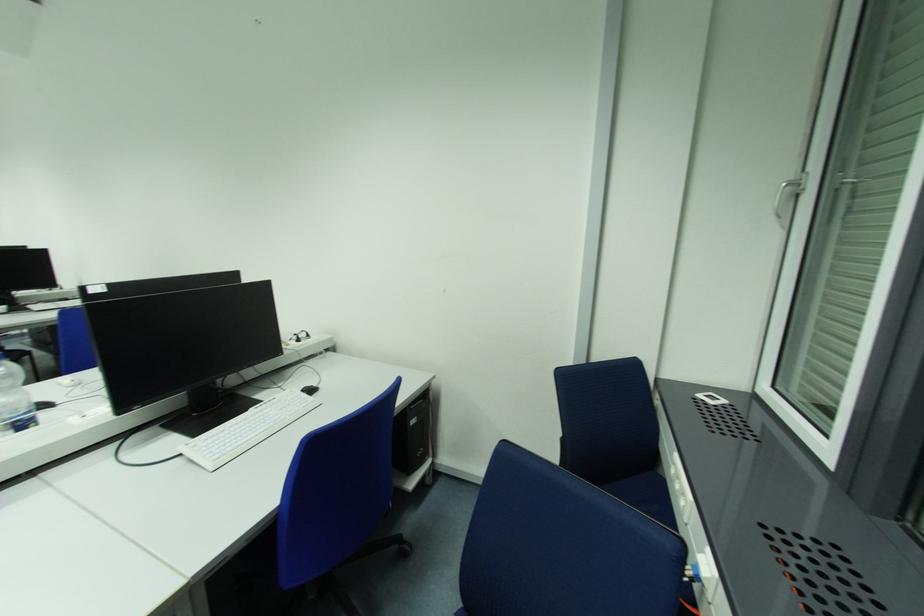
Where is `white window handle`? The image size is (924, 616). white window handle is located at coordinates (779, 199).